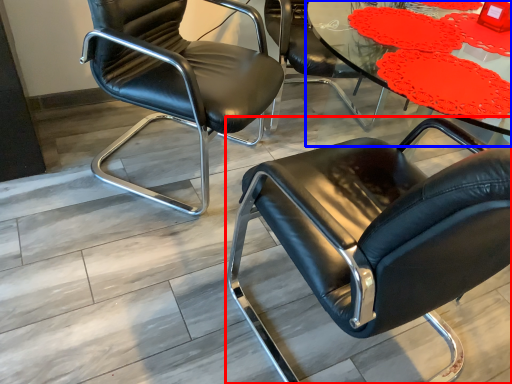
Question: Which object is further to the camera taking this photo, chair (highlighted by a red box) or table (highlighted by a blue box)?

Choices:
 (A) chair
 (B) table

Answer: (B)